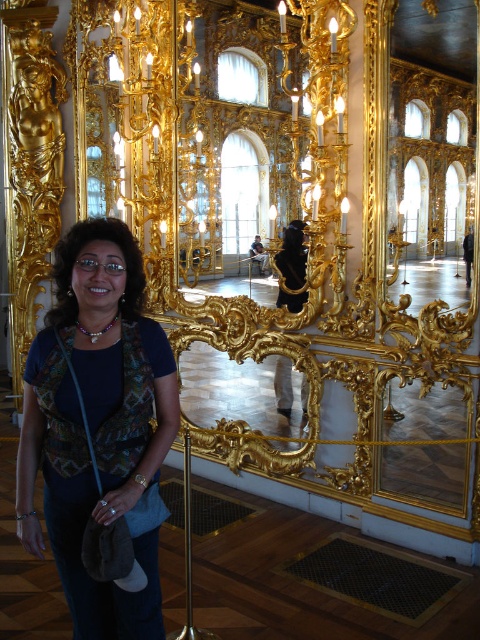
Which of these two, matte blue shirt at center or gold ornate mirror at center, stands taller?

matte blue shirt at center

Is point (168, 416) farther from camera compared to point (195, 369)?

That is False.

This screenshot has height=640, width=480. I want to click on matte blue shirt at center, so click(x=97, y=426).